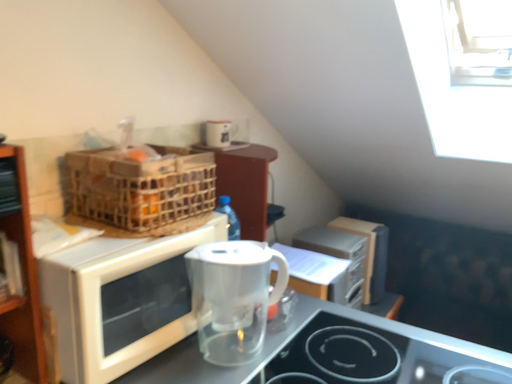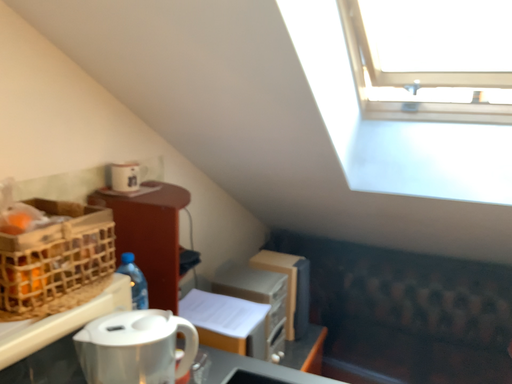
Question: How did the camera likely rotate when shooting the video?

Choices:
 (A) rotated left
 (B) rotated right

Answer: (B)